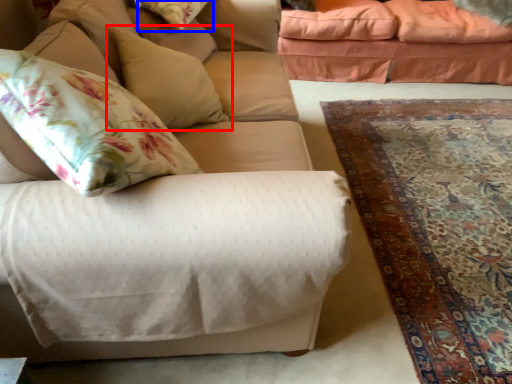
Question: Which of the following is the farthest to the observer, pillow (highlighted by a red box) or pillow (highlighted by a blue box)?

Choices:
 (A) pillow
 (B) pillow

Answer: (B)